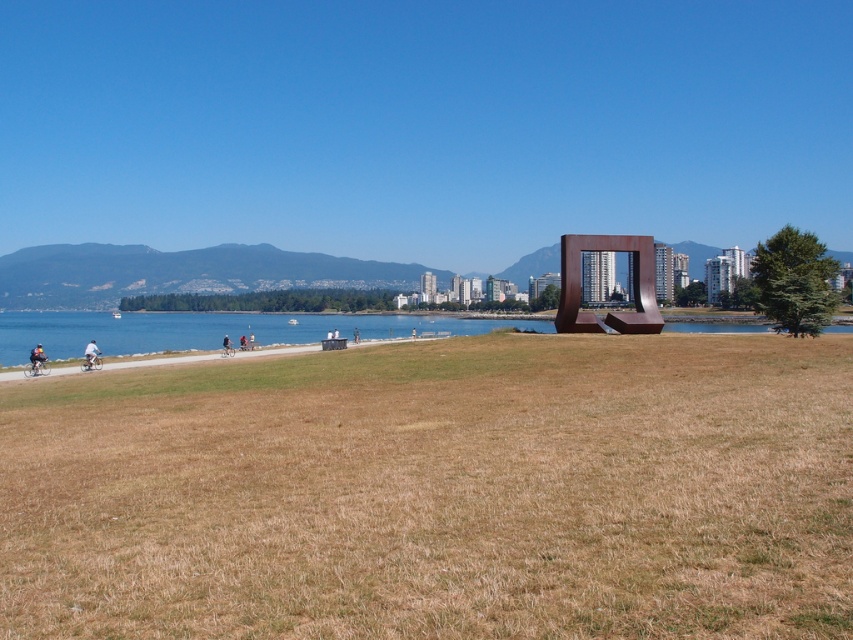
Where is `rustic metal sculpture at center`? rustic metal sculpture at center is located at coordinates (631, 284).

Which of these two, rustic metal sculpture at center or light blue fabric at center, stands taller?

rustic metal sculpture at center is taller.

Between point (561, 236) and point (96, 355), which one is positioned behind?

The point (561, 236) is behind.

Find the location of `rustic metal sculpture at center`. rustic metal sculpture at center is located at coordinates (631, 284).

Between green grass at lower center and blue fabric jacket at center, which one has more height?

Standing taller between the two is green grass at lower center.

Based on the photo, between green grass at lower center and blue fabric jacket at center, which one appears on the right side from the viewer's perspective?

From the viewer's perspective, green grass at lower center appears more on the right side.

Which is in front, point (51, 376) or point (228, 346)?

Point (51, 376) is more forward.

Identify the location of green grass at lower center. (161, 360).

Who is shorter, light blue fabric at center or blue fabric jacket at center?

blue fabric jacket at center is shorter.

Can you confirm if light blue fabric at center is thinner than blue fabric jacket at center?

In fact, light blue fabric at center might be wider than blue fabric jacket at center.

Between point (91, 360) and point (225, 339), which one is positioned in front?

Point (91, 360) is more forward.

At what (x,y) coordinates should I click in order to perform the action: click on light blue fabric at center. Please return your answer as a coordinate pair (x, y). Looking at the image, I should click on (91, 355).